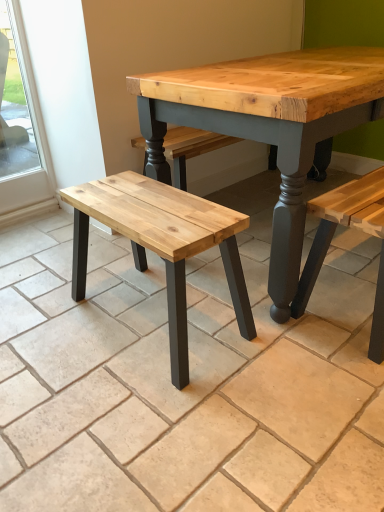
Question: Considering the relative sizes of natural wood bench at left and natural wood bench at center in the image provided, is natural wood bench at left smaller than natural wood bench at center?

Choices:
 (A) yes
 (B) no

Answer: (A)

Question: From the image's perspective, does natural wood bench at left appear higher than natural wood bench at center?

Choices:
 (A) yes
 (B) no

Answer: (B)

Question: Does natural wood bench at left lie behind natural wood bench at center?

Choices:
 (A) no
 (B) yes

Answer: (B)

Question: Could you tell me if natural wood bench at left is facing natural wood bench at center?

Choices:
 (A) yes
 (B) no

Answer: (B)

Question: From a real-world perspective, is natural wood bench at left under natural wood bench at center?

Choices:
 (A) yes
 (B) no

Answer: (B)

Question: From a real-world perspective, is natural wood bench at left physically located above or below natural wood bench at center?

Choices:
 (A) above
 (B) below

Answer: (A)

Question: Considering their positions, is natural wood bench at left located in front of or behind natural wood bench at center?

Choices:
 (A) behind
 (B) front

Answer: (A)

Question: In terms of width, does natural wood bench at left look wider or thinner when compared to natural wood bench at center?

Choices:
 (A) thin
 (B) wide

Answer: (A)

Question: From the image's perspective, is natural wood bench at left above or below natural wood bench at center?

Choices:
 (A) below
 (B) above

Answer: (A)

Question: Is point (261, 381) closer or farther from the camera than point (29, 148)?

Choices:
 (A) closer
 (B) farther

Answer: (A)

Question: Is natural wood bench at center to the left or to the right of clear glass window at left in the image?

Choices:
 (A) left
 (B) right

Answer: (B)

Question: Is natural wood bench at center in front of or behind clear glass window at left in the image?

Choices:
 (A) behind
 (B) front

Answer: (B)

Question: Would you say natural wood bench at center is inside or outside clear glass window at left?

Choices:
 (A) inside
 (B) outside

Answer: (B)

Question: Based on their sizes in the image, would you say clear glass window at left is bigger or smaller than natural wood bench at left?

Choices:
 (A) big
 (B) small

Answer: (B)

Question: Looking at their shapes, would you say clear glass window at left is wider or thinner than natural wood bench at left?

Choices:
 (A) wide
 (B) thin

Answer: (B)